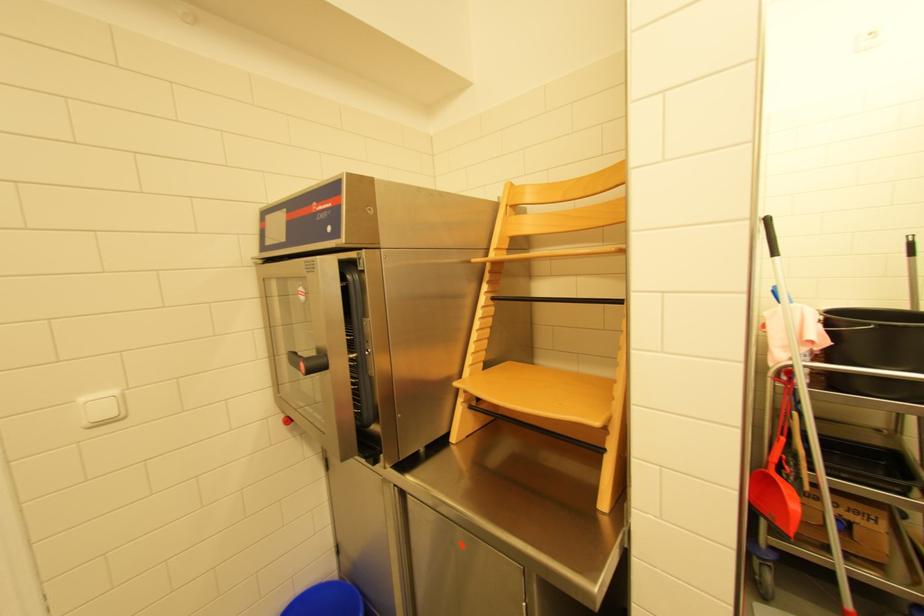
What do you see at coordinates (301, 362) in the screenshot? I see `the black oven handle` at bounding box center [301, 362].